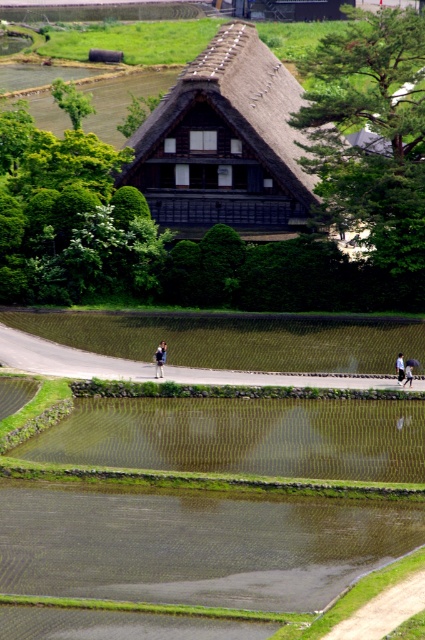
Is blue denim jacket at lower center above light blue fabric at lower right?

Correct, blue denim jacket at lower center is located above light blue fabric at lower right.

Is point (158, 346) less distant than point (399, 353)?

That is False.

Who is more forward, (161, 364) or (404, 365)?

Point (404, 365)

Where is `blue denim jacket at lower center`? This screenshot has width=425, height=640. blue denim jacket at lower center is located at coordinates (159, 358).

Does light blue fabric at lower right have a lesser width compared to blue fabric umbrella at lower center?

Yes, light blue fabric at lower right is thinner than blue fabric umbrella at lower center.

Find the location of a particular element. light blue fabric at lower right is located at coordinates (399, 368).

Based on the photo, between blue denim jacket at lower center and blue fabric umbrella at lower center, which one appears on the right side from the viewer's perspective?

blue fabric umbrella at lower center

Is blue denim jacket at lower center below blue fabric umbrella at lower center?

Incorrect, blue denim jacket at lower center is not positioned below blue fabric umbrella at lower center.

What do you see at coordinates (159, 358) in the screenshot? The width and height of the screenshot is (425, 640). I see `blue denim jacket at lower center` at bounding box center [159, 358].

Locate an element on the screen. The width and height of the screenshot is (425, 640). blue denim jacket at lower center is located at coordinates (159, 358).